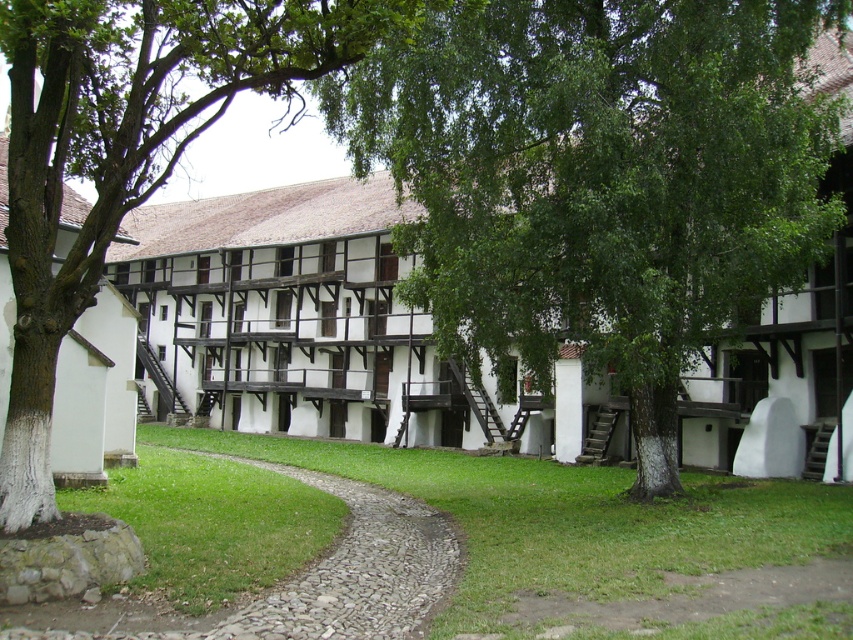
Who is more forward, (123,86) or (701,497)?

Point (123,86) is more forward.

Where is `green leafy tree at left`? The image size is (853, 640). green leafy tree at left is located at coordinates (126, 148).

Locate an element on the screen. This screenshot has width=853, height=640. green leafy tree at left is located at coordinates (126, 148).

Based on the photo, who is positioned more to the left, green grass at center or gray gravel path at center?

Positioned to the left is gray gravel path at center.

Is green grass at center to the right of gray gravel path at center from the viewer's perspective?

Indeed, green grass at center is positioned on the right side of gray gravel path at center.

In order to click on green grass at center in this screenshot , I will do `click(567, 524)`.

Can you confirm if green leafy tree at left is positioned below gray gravel path at center?

Actually, green leafy tree at left is above gray gravel path at center.

Does green leafy tree at left appear on the left side of gray gravel path at center?

Yes, green leafy tree at left is to the left of gray gravel path at center.

The height and width of the screenshot is (640, 853). Identify the location of green leafy tree at left. (126, 148).

You are a GUI agent. You are given a task and a screenshot of the screen. Output one action in this format:
    pyautogui.click(x=<x>, y=<y>)
    Task: Click on the green leafy tree at left
    The width and height of the screenshot is (853, 640).
    Given the screenshot: What is the action you would take?
    pyautogui.click(x=126, y=148)